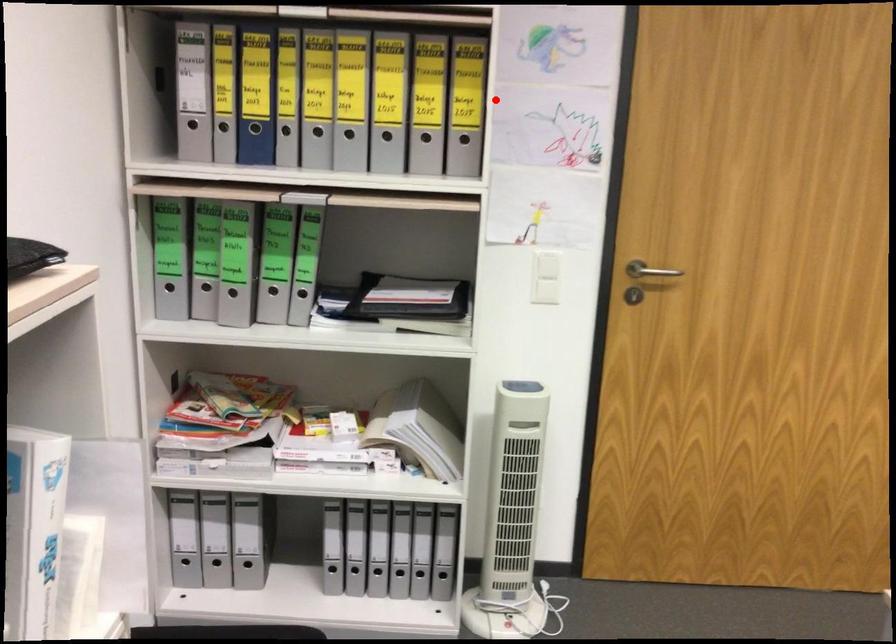
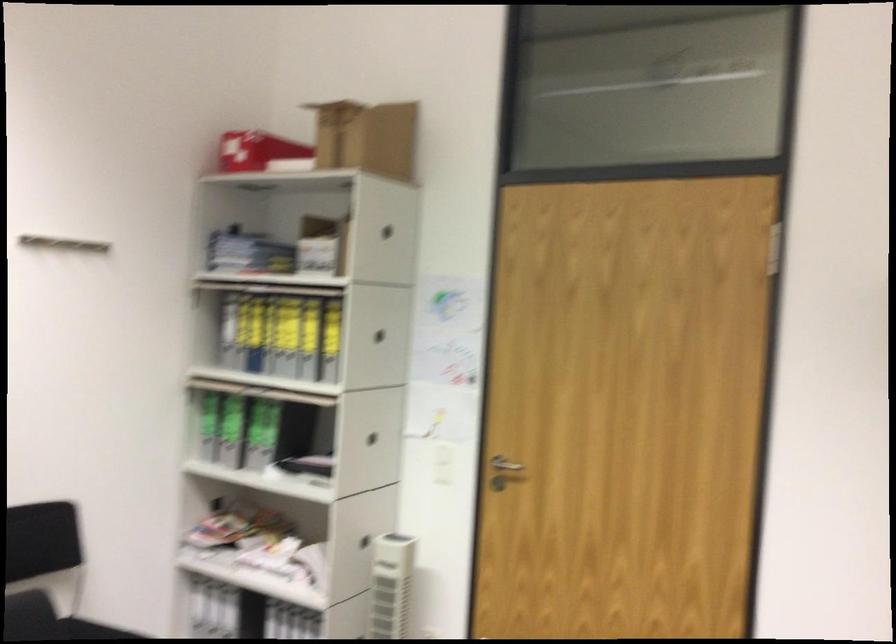
Locate, in the second image, the point that corresponds to the highlighted location in the first image.

(378, 335)